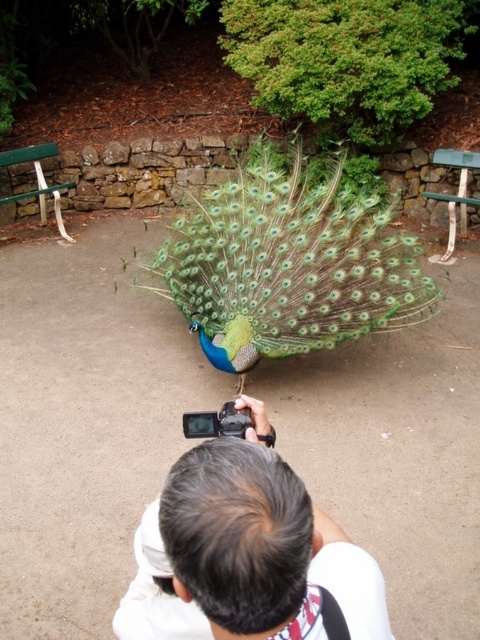
Question: Is gray hair at center further to the viewer compared to green plastic bench at upper right?

Choices:
 (A) yes
 (B) no

Answer: (B)

Question: Is gray hair at center to the left of green plastic bench at upper right from the viewer's perspective?

Choices:
 (A) yes
 (B) no

Answer: (A)

Question: Among these objects, which one is nearest to the camera?

Choices:
 (A) green painted wood park bench at left
 (B) shiny blue peacock at center

Answer: (B)

Question: Which of the following is the farthest from the observer?

Choices:
 (A) green painted wood park bench at left
 (B) green plastic bench at upper right

Answer: (A)

Question: Which object appears closest to the camera in this image?

Choices:
 (A) green painted wood park bench at left
 (B) green plastic bench at upper right

Answer: (B)

Question: Does shiny blue peacock at center have a larger size compared to green plastic bench at upper right?

Choices:
 (A) yes
 (B) no

Answer: (A)